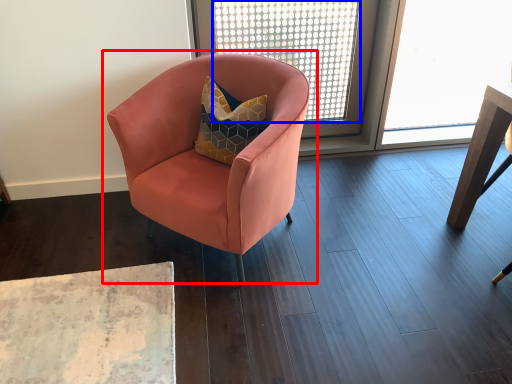
Question: Which of the following is the farthest to the observer, chair (highlighted by a red box) or window screen (highlighted by a blue box)?

Choices:
 (A) chair
 (B) window screen

Answer: (B)